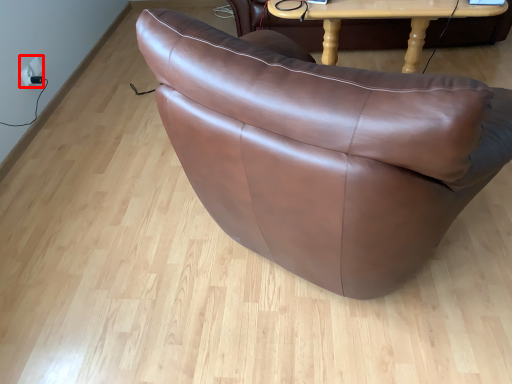
Question: In this image, where is electric outlet (annotated by the red box) located relative to table?

Choices:
 (A) left
 (B) right

Answer: (A)